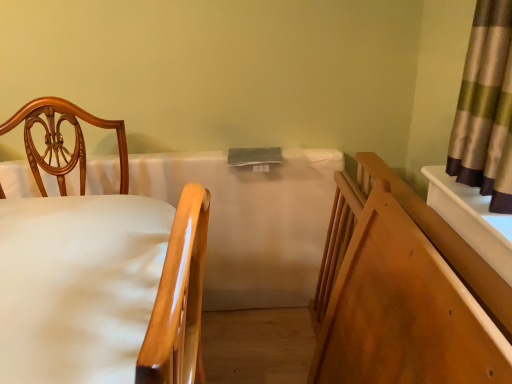
Question: Does wooden chair at left contain wooden bed frame at right?

Choices:
 (A) yes
 (B) no

Answer: (B)

Question: Does wooden chair at left have a greater height compared to wooden bed frame at right?

Choices:
 (A) yes
 (B) no

Answer: (A)

Question: From a real-world perspective, is wooden chair at left below wooden bed frame at right?

Choices:
 (A) no
 (B) yes

Answer: (A)

Question: Is wooden chair at left at the left side of wooden bed frame at right?

Choices:
 (A) yes
 (B) no

Answer: (A)

Question: Is wooden chair at left positioned with its back to wooden bed frame at right?

Choices:
 (A) no
 (B) yes

Answer: (B)

Question: In the image, is wooden chair at left positioned in front of or behind white fabric mattress at center?

Choices:
 (A) behind
 (B) front

Answer: (B)

Question: In the image, is wooden chair at left on the left side or the right side of white fabric mattress at center?

Choices:
 (A) left
 (B) right

Answer: (B)

Question: From the image's perspective, is wooden chair at left located above or below white fabric mattress at center?

Choices:
 (A) above
 (B) below

Answer: (B)

Question: From a real-world perspective, is wooden chair at left above or below white fabric mattress at center?

Choices:
 (A) above
 (B) below

Answer: (A)

Question: Based on their sizes in the image, would you say white fabric mattress at center is bigger or smaller than wooden chair at left?

Choices:
 (A) big
 (B) small

Answer: (A)

Question: From the image's perspective, relative to wooden chair at left, is white fabric mattress at center above or below?

Choices:
 (A) above
 (B) below

Answer: (A)

Question: Looking at their shapes, would you say white fabric mattress at center is wider or thinner than wooden chair at left?

Choices:
 (A) wide
 (B) thin

Answer: (B)

Question: Do you think white fabric mattress at center is within wooden chair at left, or outside of it?

Choices:
 (A) outside
 (B) inside

Answer: (A)

Question: Looking at their shapes, would you say wooden chair at left is wider or thinner than wooden bed frame at right?

Choices:
 (A) thin
 (B) wide

Answer: (B)

Question: Is wooden chair at left in front of or behind wooden bed frame at right in the image?

Choices:
 (A) front
 (B) behind

Answer: (A)